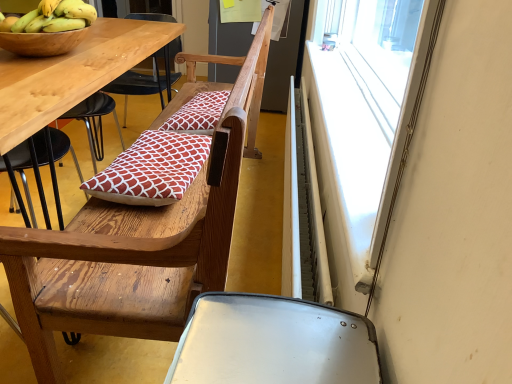
This screenshot has width=512, height=384. I want to click on vacant space underneath yellow matte bananas at upper left (from a real-world perspective), so click(x=58, y=26).